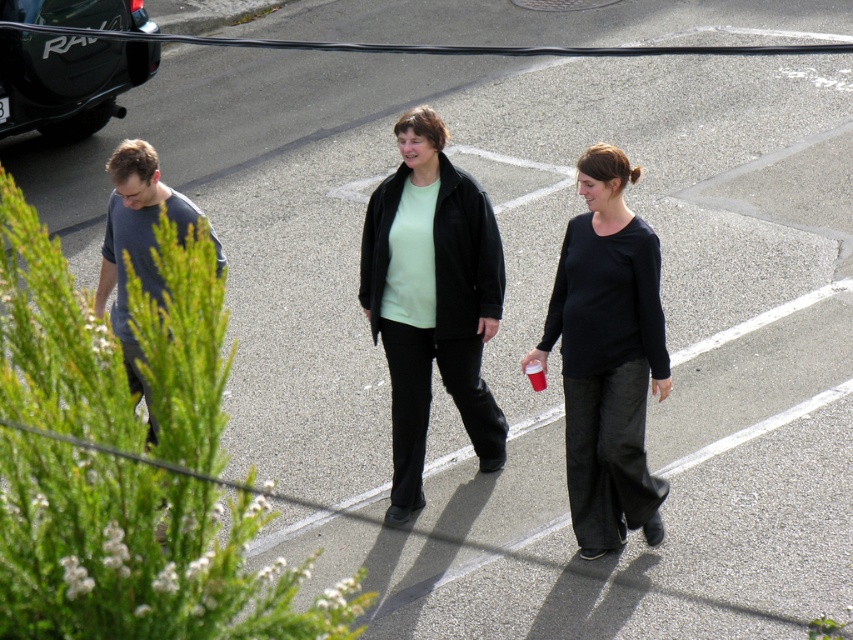
Question: Which point is closer to the camera taking this photo?

Choices:
 (A) (96, 314)
 (B) (602, 506)

Answer: (A)

Question: Which point appears farthest from the camera in this image?

Choices:
 (A) (61, 84)
 (B) (624, 426)
 (C) (103, 282)

Answer: (A)

Question: Does matte black suv at upper left have a lesser width compared to gray cotton shirt at left?

Choices:
 (A) no
 (B) yes

Answer: (A)

Question: Can you confirm if black matte shirt at center is positioned to the left of matte black suv at upper left?

Choices:
 (A) no
 (B) yes

Answer: (A)

Question: Is matte black jacket at center thinner than gray cotton shirt at left?

Choices:
 (A) no
 (B) yes

Answer: (B)

Question: Which object is the closest to the gray cotton shirt at left?

Choices:
 (A) matte black suv at upper left
 (B) black matte shirt at center

Answer: (B)